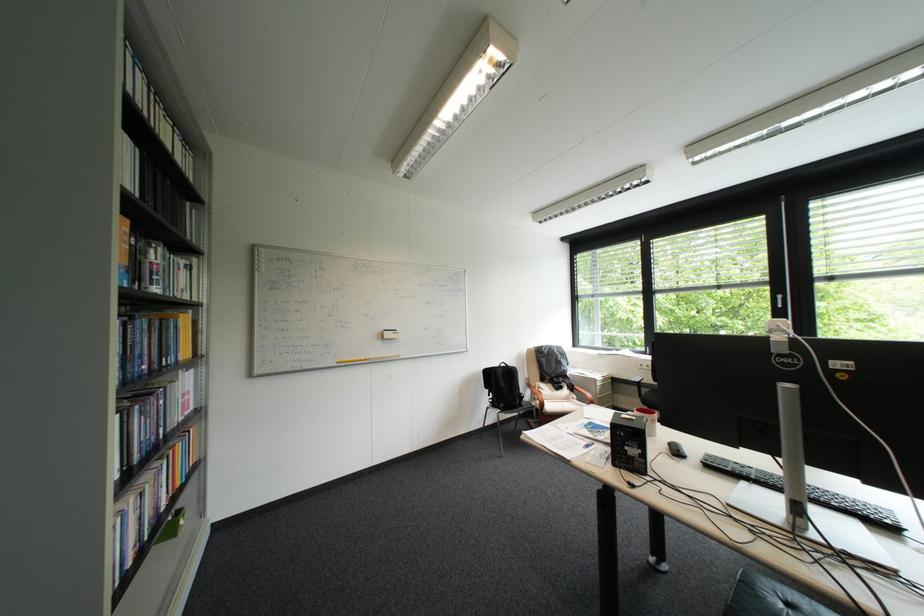
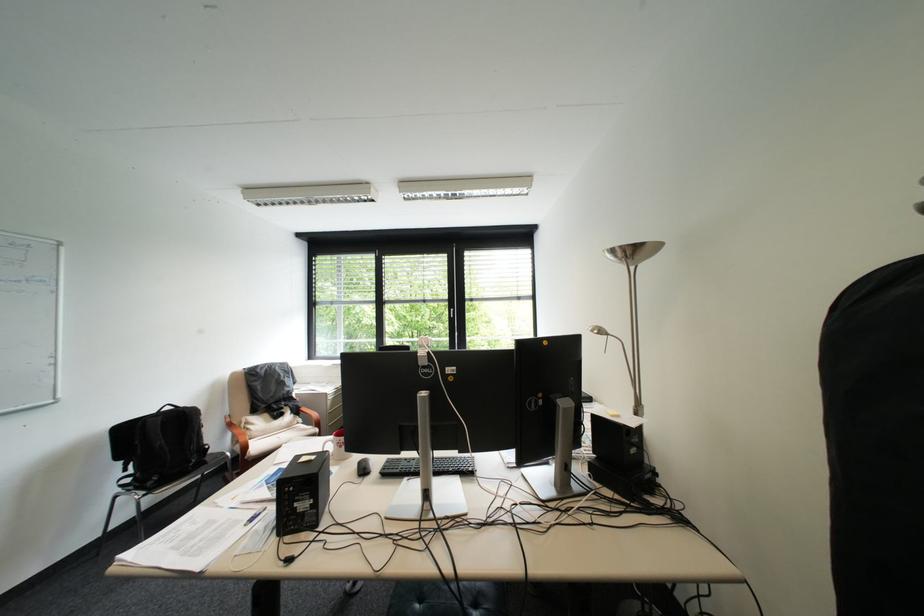
Find the pixel in the second image that matches pixel 655 419 in the first image.

(337, 455)